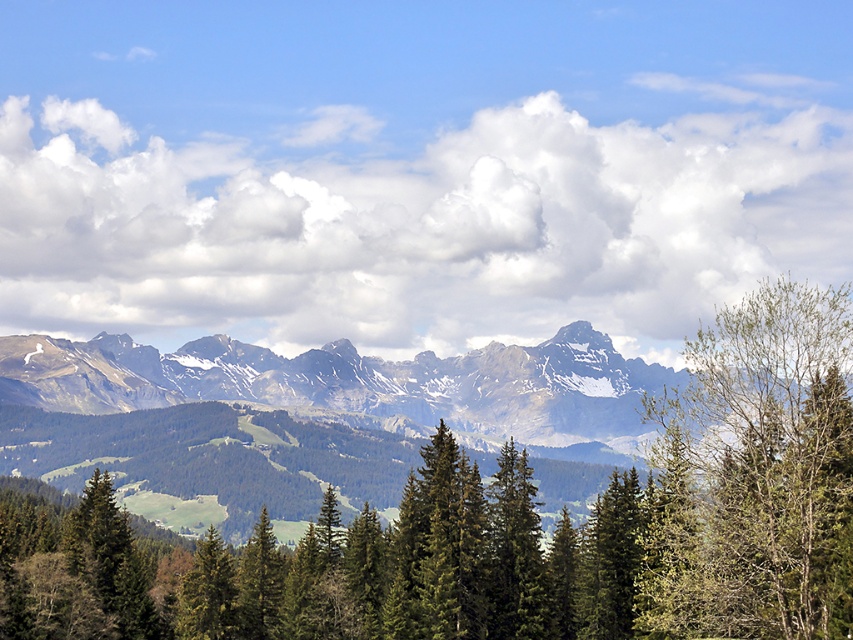
Does gray rocky mountain range at center have a greater width compared to green matte tree at lower left?

Correct, the width of gray rocky mountain range at center exceeds that of green matte tree at lower left.

Does point (573, 352) come closer to viewer compared to point (202, 547)?

No.

In order to click on gray rocky mountain range at center in this screenshot , I will do `click(302, 416)`.

Does gray rocky mountain range at center have a lesser width compared to green matte tree at lower center?

No.

Who is higher up, gray rocky mountain range at center or green matte tree at lower center?

gray rocky mountain range at center is higher up.

Does point (469, 413) come in front of point (252, 572)?

No, (469, 413) is behind (252, 572).

I want to click on gray rocky mountain range at center, so click(x=302, y=416).

Looking at this image, can you confirm if green leafy tree at upper right is shorter than green matte tree at lower center?

No.

Looking at this image, is green leafy tree at upper right wider than green matte tree at lower center?

Yes, green leafy tree at upper right is wider than green matte tree at lower center.

Is point (782, 600) positioned in front of point (250, 618)?

Yes, point (782, 600) is in front of point (250, 618).

Where is `green leafy tree at upper right`? This screenshot has height=640, width=853. green leafy tree at upper right is located at coordinates (755, 476).